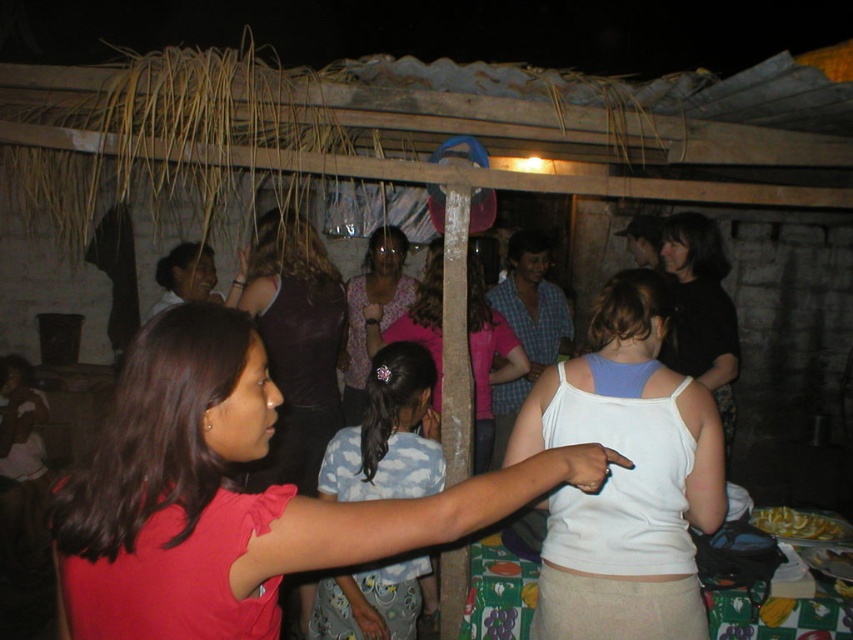
You are a photographer at the event and want to capture both the pink fabric shirt at center and the white fabric tank top at center in a single photo. Which clothing item will appear larger in the photo?

The pink fabric shirt at center will appear larger in the photo because it is closer to the viewer than the white fabric tank top at center.

Looking at this image, you are organizing a clothing display and need to arrange the white fabric tank top at center and the floral fabric blouse at center on a shelf. Given their sizes, which one should you place first to maximize shelf space efficiency?

The white fabric tank top at center occupies less space than floral fabric blouse at center, so you should place the floral fabric blouse at center first to utilize the shelf space more efficiently.